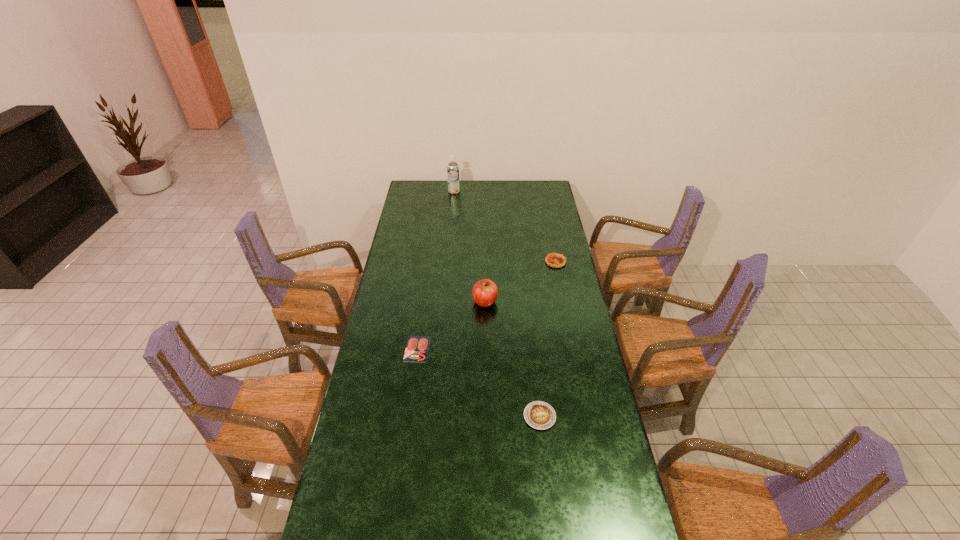
The image size is (960, 540). What are the coordinates of `vacant space at the right edge of the desktop` in the screenshot? It's located at (595, 397).

Identify the location of free spot between the left quiche and the shortest object. The width and height of the screenshot is (960, 540). (478, 382).

Identify the location of free point between the soya milk and the rightmost object. (505, 227).

Where is `free area in between the fourth object from left to right and the third farthest object`? free area in between the fourth object from left to right and the third farthest object is located at coordinates (513, 359).

You are a GUI agent. You are given a task and a screenshot of the screen. Output one action in this format:
    pyautogui.click(x=<x>, y=<y>)
    Task: Click on the vacant space that is in between the tallest object and the nearest object
    The height and width of the screenshot is (540, 960).
    Given the screenshot: What is the action you would take?
    pyautogui.click(x=497, y=304)

Find the location of a particular element. This screenshot has height=540, width=960. vacant space that is in between the left quiche and the fourth nearest object is located at coordinates (547, 339).

The image size is (960, 540). Find the location of `vacant region between the soya milk and the farther quiche`. vacant region between the soya milk and the farther quiche is located at coordinates (505, 227).

Where is `free area in between the second farthest object and the fourth shortest object`? This screenshot has height=540, width=960. free area in between the second farthest object and the fourth shortest object is located at coordinates (520, 282).

The height and width of the screenshot is (540, 960). Identify the location of free space that is in between the fourth shortest object and the leftmost object. (451, 325).

Locate an element on the screen. free spot between the second object from right to left and the third object from right to left is located at coordinates (513, 359).